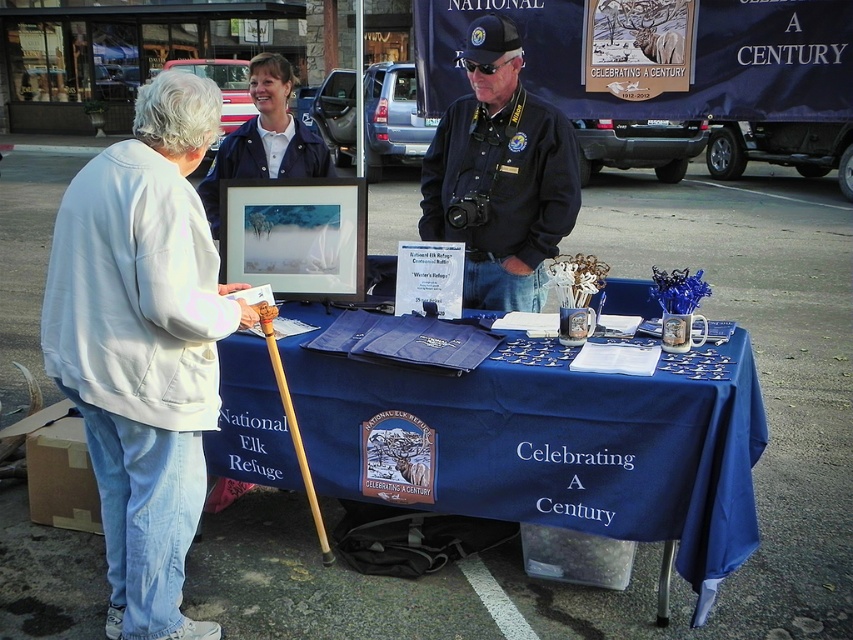
You are a visitor at the event and want to approach the booth. You are currently standing 2.25 meters away from the white cotton jacket at left. Is there enough space for you to walk towards the booth without needing to move closer than 2 meters?

The distance between you and the white cotton jacket at left is 2.25 meters. Since 2.25 meters is greater than 2 meters, there is enough space to walk towards the booth without needing to move closer than 2 meters.

You are attending the event and want to approach the booth. From your current position, which object is closer to you, the blue fabric table at center or the white cotton jacket at left?

The white cotton jacket at left is closer to you because it is positioned to the left of the blue fabric table at center, which is further to the right.

Consider the image. What is located at the point with coordinates [558,448] in the image?

The point at coordinates [558,448] indicates the blue fabric table at center.